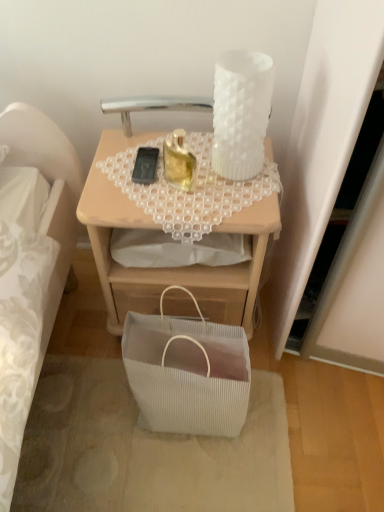
You are a GUI agent. You are given a task and a screenshot of the screen. Output one action in this format:
    pyautogui.click(x=<x>, y=<y>)
    Task: Click on the free spot to the left of white frosted glass candle holder at upper right, the 2th candle holder from the left
    
    Given the screenshot: What is the action you would take?
    pyautogui.click(x=158, y=166)